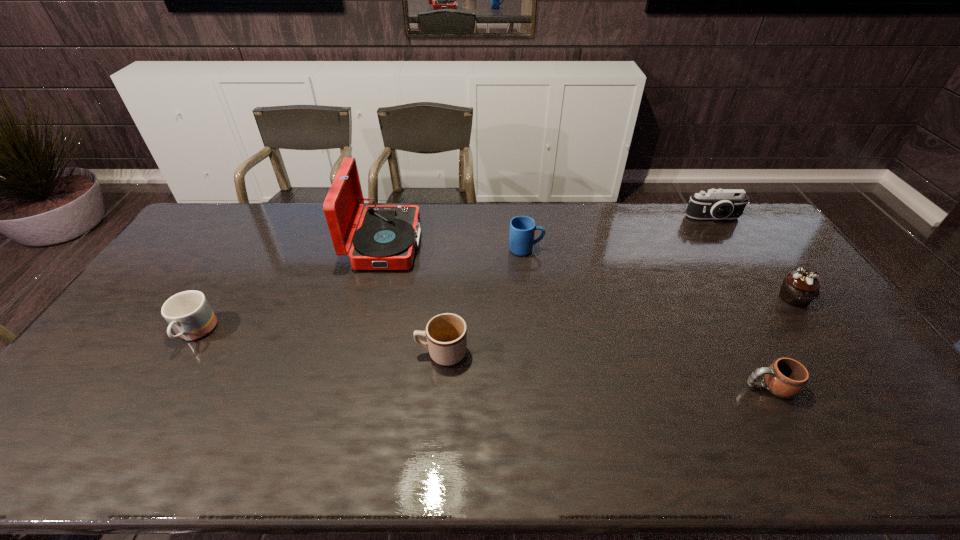
Identify the location of the tallest object. Image resolution: width=960 pixels, height=540 pixels. (387, 235).

Image resolution: width=960 pixels, height=540 pixels. In order to click on the second object from left to right in this screenshot , I will do `click(387, 235)`.

This screenshot has height=540, width=960. Find the location of `camera`. camera is located at coordinates (716, 203).

Find the location of a particular element. The height and width of the screenshot is (540, 960). the fourth object from left to right is located at coordinates (522, 228).

The image size is (960, 540). In order to click on the third mug from left to right in this screenshot , I will do `click(522, 228)`.

Find the location of a particular element. Image resolution: width=960 pixels, height=540 pixels. the third object from left to right is located at coordinates (446, 334).

Locate an element on the screen. Image resolution: width=960 pixels, height=540 pixels. the fourth nearest object is located at coordinates (799, 288).

I want to click on the leftmost object, so point(188,313).

You are a GUI agent. You are given a task and a screenshot of the screen. Output one action in this format:
    pyautogui.click(x=<x>, y=<y>)
    Task: Click on the nearest object
    The image size is (960, 540).
    Given the screenshot: What is the action you would take?
    pyautogui.click(x=785, y=377)

You are a GUI agent. You are given a task and a screenshot of the screen. Output one action in this format:
    pyautogui.click(x=<x>, y=<y>)
    Task: Click on the shortest mug
    This screenshot has height=540, width=960.
    Given the screenshot: What is the action you would take?
    pyautogui.click(x=785, y=377)